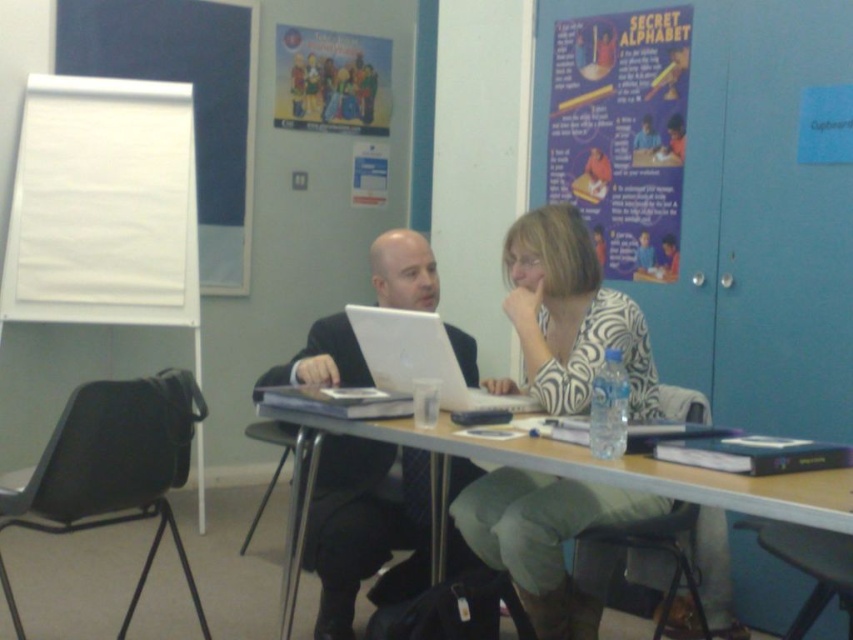
You are an attendee at a meeting in this room. You need to write a note on the surface that is taller. Which object should you choose between the white paperboard at left and the matte paper poster at upper right?

The white paperboard at left is taller than the matte paper poster at upper right, so you should choose the white paperboard at left to write your note.

You are organizing a presentation and need to place a 1.5 meter long banner between the white paperboard at left and the matte black suit at center. Will there be enough space?

The white paperboard at left is 1.76 meters from the matte black suit at center, so yes, the 1.5 meter long banner will fit between them since the distance is greater than the banner length.